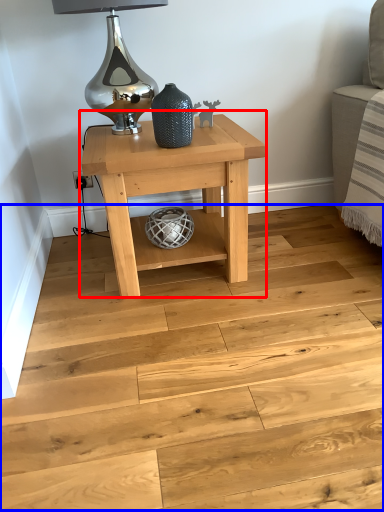
Question: Among these objects, which one is farthest to the camera, table (highlighted by a red box) or stair (highlighted by a blue box)?

Choices:
 (A) table
 (B) stair

Answer: (A)